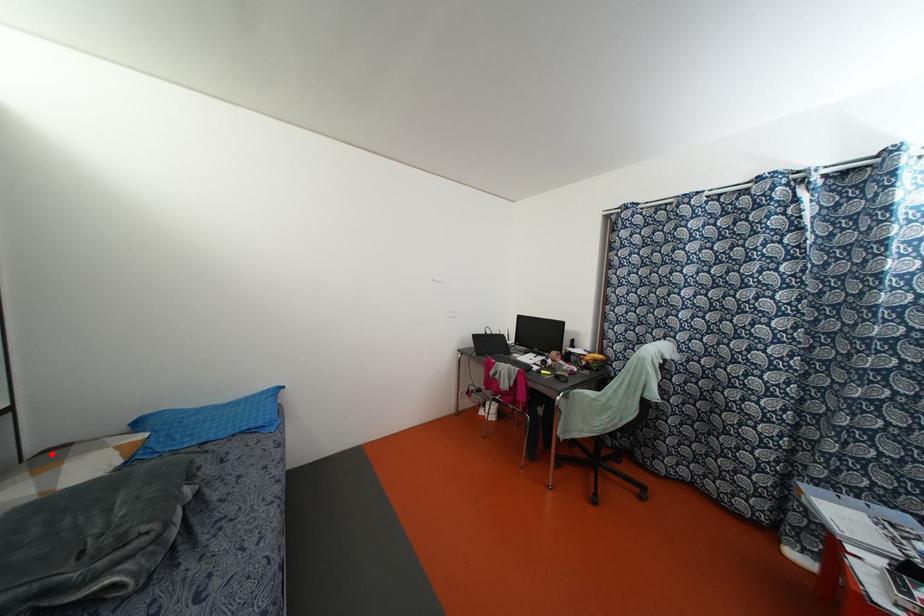
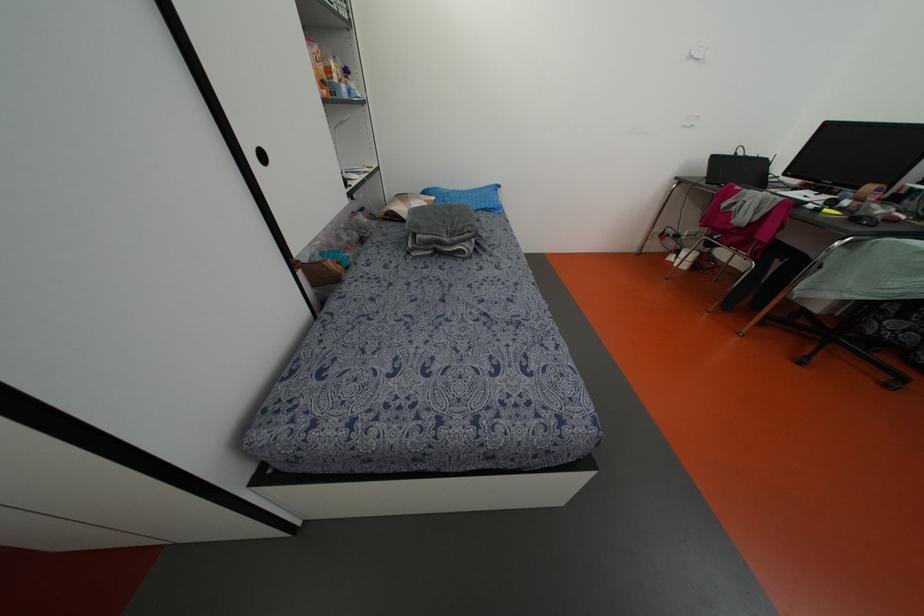
Question: A red point is marked in image1. In image2, is the corresponding 3D point closer to the camera or farther? Reply with the corresponding letter.

Choices:
 (A) The corresponding 3D point is closer.
 (B) The corresponding 3D point is farther.

Answer: (B)